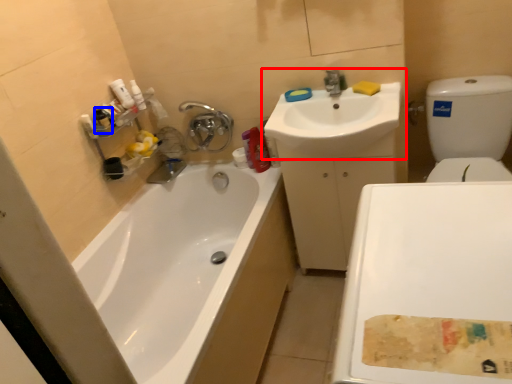
Question: Which of the following is the farthest to the observer, sink (highlighted by a red box) or mouthwash (highlighted by a blue box)?

Choices:
 (A) sink
 (B) mouthwash

Answer: (B)